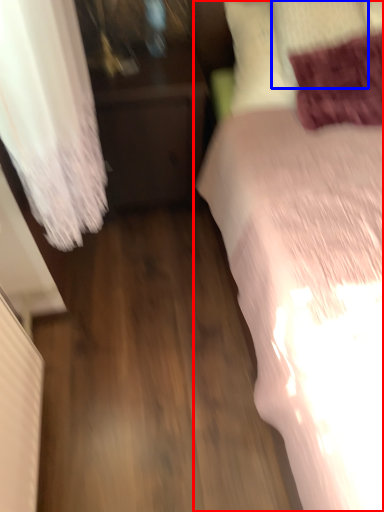
Question: Which of the following is the farthest to the observer, bed (highlighted by a red box) or pillow (highlighted by a blue box)?

Choices:
 (A) bed
 (B) pillow

Answer: (B)